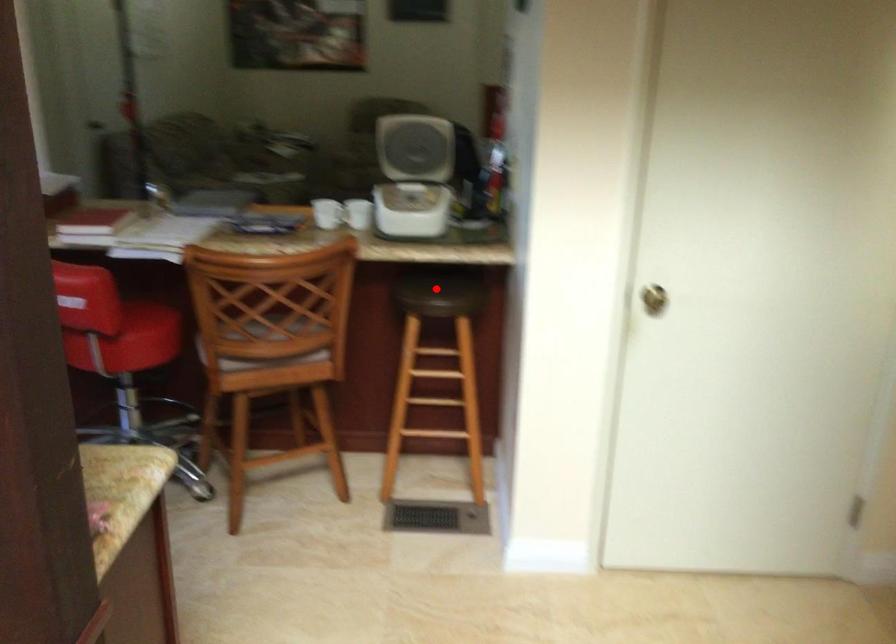
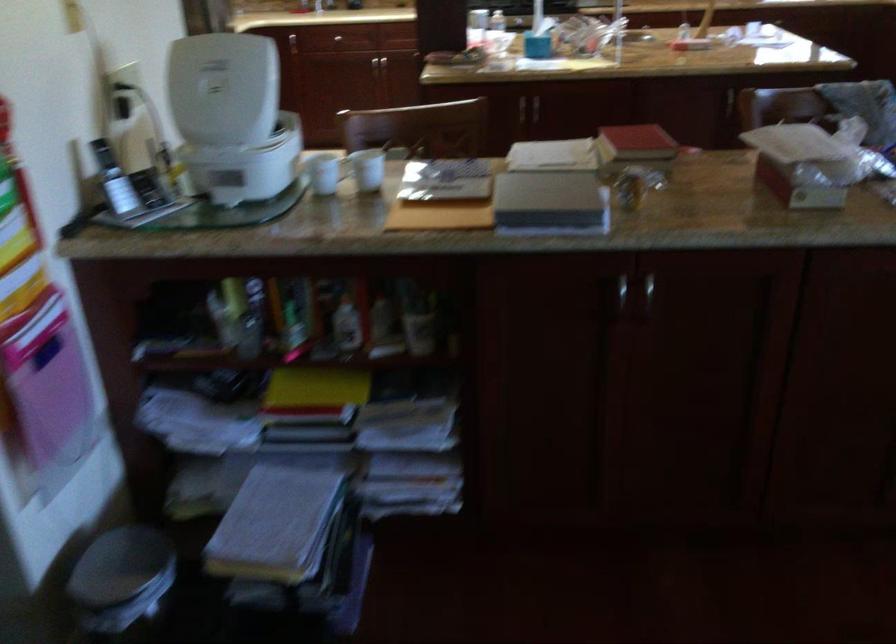
Question: I am providing you with two images of the same scene from different viewpoints. A red point is marked on the first image. Can you still see the location of the red point in image 2?

Choices:
 (A) Yes
 (B) No

Answer: (B)